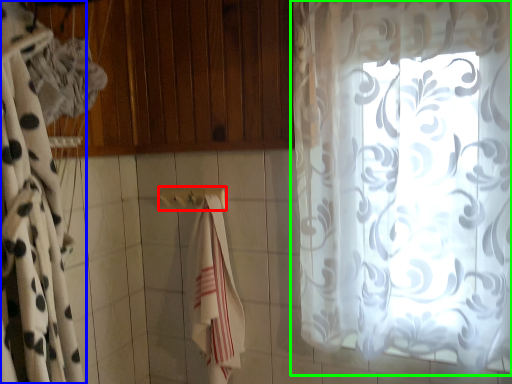
Question: Considering the real-world distances, which object is farthest from towel bar (highlighted by a red box)? curtain (highlighted by a blue box) or curtain (highlighted by a green box)?

Choices:
 (A) curtain
 (B) curtain

Answer: (B)